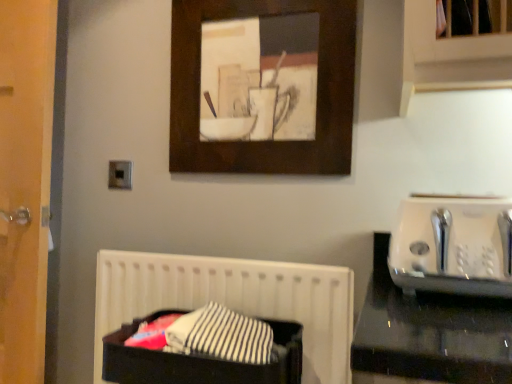
Question: Does white plastic toaster at right appear on the right side of wooden picture frame at upper center?

Choices:
 (A) no
 (B) yes

Answer: (B)

Question: From a real-world perspective, is white plastic toaster at right under wooden picture frame at upper center?

Choices:
 (A) yes
 (B) no

Answer: (A)

Question: Is white plastic toaster at right positioned beyond the bounds of wooden picture frame at upper center?

Choices:
 (A) no
 (B) yes

Answer: (B)

Question: Is white plastic toaster at right far from wooden picture frame at upper center?

Choices:
 (A) no
 (B) yes

Answer: (A)

Question: Can you confirm if white plastic toaster at right is thinner than wooden picture frame at upper center?

Choices:
 (A) no
 (B) yes

Answer: (A)

Question: Looking at the image, does black fabric at lower left seem bigger or smaller compared to black fabric laundry basket at lower center?

Choices:
 (A) small
 (B) big

Answer: (B)

Question: From the image's perspective, is black fabric at lower left above or below black fabric laundry basket at lower center?

Choices:
 (A) below
 (B) above

Answer: (A)

Question: From their relative heights in the image, would you say black fabric at lower left is taller or shorter than black fabric laundry basket at lower center?

Choices:
 (A) tall
 (B) short

Answer: (A)

Question: Is black fabric at lower left in front of or behind black fabric laundry basket at lower center in the image?

Choices:
 (A) front
 (B) behind

Answer: (B)

Question: From a real-world perspective, relative to white plastic toaster at right, is wooden picture frame at upper center vertically above or below?

Choices:
 (A) below
 (B) above

Answer: (B)

Question: Does point (198, 64) appear closer or farther from the camera than point (421, 269)?

Choices:
 (A) closer
 (B) farther

Answer: (B)

Question: In terms of size, does wooden picture frame at upper center appear bigger or smaller than white plastic toaster at right?

Choices:
 (A) small
 (B) big

Answer: (A)

Question: From the image's perspective, is wooden picture frame at upper center located above or below white plastic toaster at right?

Choices:
 (A) below
 (B) above

Answer: (B)

Question: Based on their sizes in the image, would you say wooden picture frame at upper center is bigger or smaller than black fabric laundry basket at lower center?

Choices:
 (A) small
 (B) big

Answer: (A)

Question: From a real-world perspective, is wooden picture frame at upper center above or below black fabric laundry basket at lower center?

Choices:
 (A) above
 (B) below

Answer: (A)